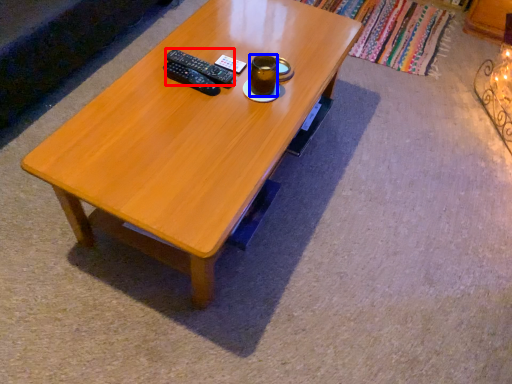
Question: Which point is closer to the camera, remote (highlighted by a red box) or beverage (highlighted by a blue box)?

Choices:
 (A) remote
 (B) beverage

Answer: (B)